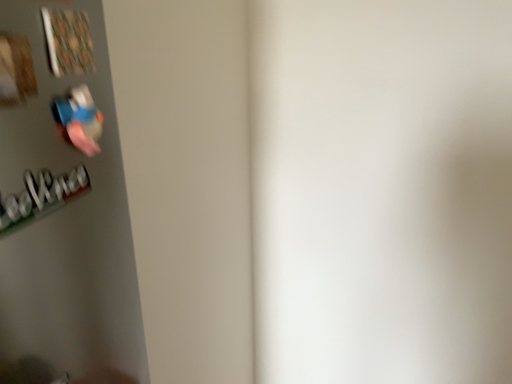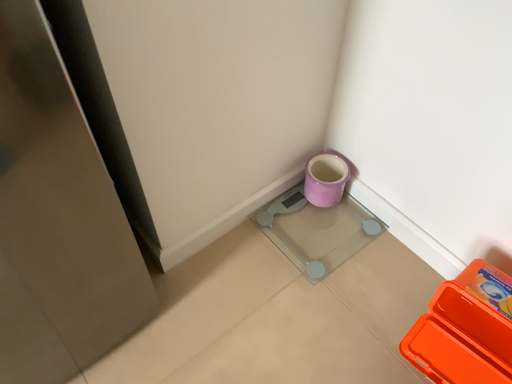
Question: Which way did the camera rotate in the video?

Choices:
 (A) rotated upward
 (B) rotated downward

Answer: (B)